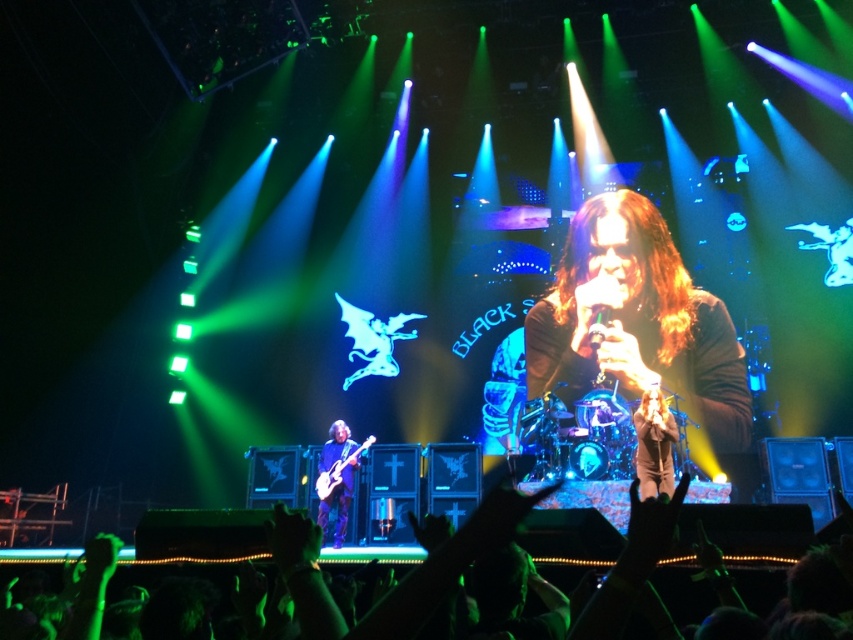
You are a stagehand who needs to store the shiny brown guitar at lower left and the shiny metallic guitar at lower center in a storage case that can only accommodate guitars up to 1 meter in width. Based on the description, will both guitars fit into the case?

The shiny brown guitar at lower left is larger in width than the shiny metallic guitar at lower center. Since the storage case can only hold guitars up to 1 meter wide, we need to know the exact width of the larger guitar. However, the description only states that the shiny brown guitar is wider than the other but doesn